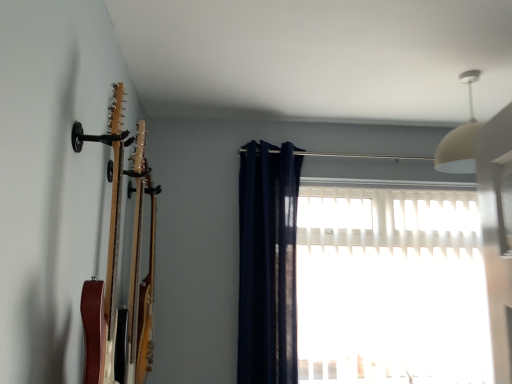
Question: From the image's perspective, is navy blue fabric curtain at center on top of white translucent blinds at center?

Choices:
 (A) yes
 (B) no

Answer: (A)

Question: Is navy blue fabric curtain at center not within white translucent blinds at center?

Choices:
 (A) yes
 (B) no

Answer: (A)

Question: Is navy blue fabric curtain at center thinner than white translucent blinds at center?

Choices:
 (A) yes
 (B) no

Answer: (B)

Question: Can you confirm if navy blue fabric curtain at center is smaller than white translucent blinds at center?

Choices:
 (A) no
 (B) yes

Answer: (B)

Question: Is navy blue fabric curtain at center positioned with its back to white translucent blinds at center?

Choices:
 (A) no
 (B) yes

Answer: (A)

Question: Considering the relative sizes of navy blue fabric curtain at center and white translucent blinds at center in the image provided, is navy blue fabric curtain at center taller than white translucent blinds at center?

Choices:
 (A) no
 (B) yes

Answer: (B)

Question: Is white translucent blinds at center thinner than navy blue fabric curtain at center?

Choices:
 (A) yes
 (B) no

Answer: (A)

Question: Does white translucent blinds at center have a larger size compared to navy blue fabric curtain at center?

Choices:
 (A) yes
 (B) no

Answer: (A)

Question: Is white translucent blinds at center positioned with its back to navy blue fabric curtain at center?

Choices:
 (A) yes
 (B) no

Answer: (B)

Question: Is white translucent blinds at center positioned in front of navy blue fabric curtain at center?

Choices:
 (A) no
 (B) yes

Answer: (A)

Question: From a real-world perspective, is white translucent blinds at center beneath navy blue fabric curtain at center?

Choices:
 (A) yes
 (B) no

Answer: (A)

Question: Can you see white translucent blinds at center touching navy blue fabric curtain at center?

Choices:
 (A) no
 (B) yes

Answer: (A)

Question: Is navy blue fabric curtain at center thinner than wooden acoustic guitar at left?

Choices:
 (A) no
 (B) yes

Answer: (A)